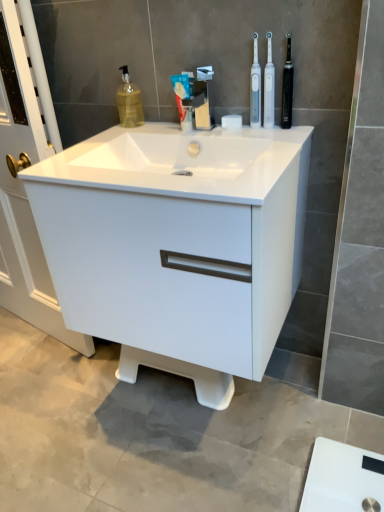
What are the coordinates of `vacant area that is situated to the right of white matte toothpaste at center` in the screenshot? It's located at (233, 130).